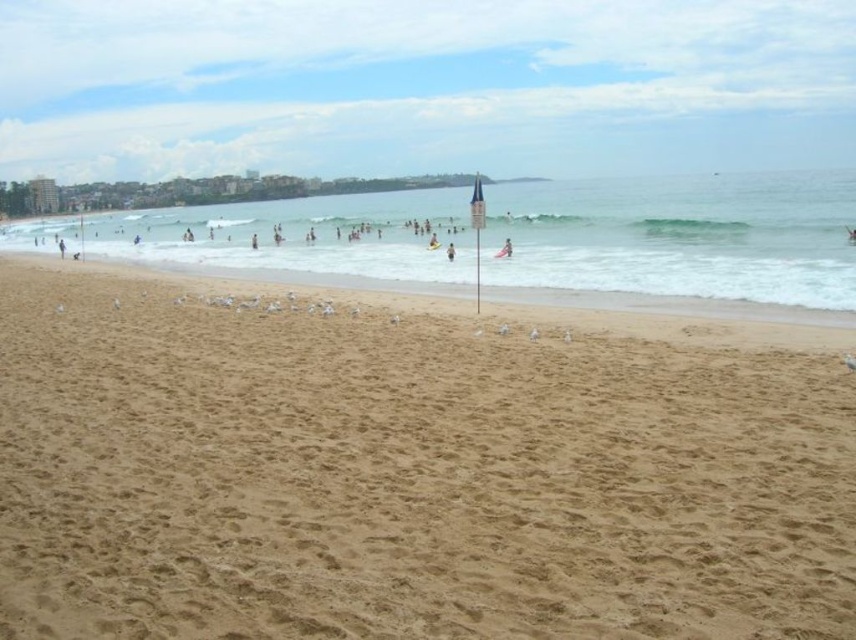
Question: Does clear blue water at center have a larger size compared to yellow rubber ring at center?

Choices:
 (A) no
 (B) yes

Answer: (B)

Question: Is brown sandy beach at center wider than light blue fabric surfboard at center?

Choices:
 (A) yes
 (B) no

Answer: (A)

Question: Can you confirm if light blue fabric surfboard at center is positioned below yellow rubber ring at center?

Choices:
 (A) yes
 (B) no

Answer: (A)

Question: Which object appears closest to the camera in this image?

Choices:
 (A) brown sandy beach at center
 (B) clear blue water at center

Answer: (A)

Question: Which object is closer to the camera taking this photo?

Choices:
 (A) light blue fabric surfboard at center
 (B) clear blue water at center
 (C) brown sandy beach at center
 (D) yellow rubber ring at center

Answer: (C)

Question: Estimate the real-world distances between objects in this image. Which object is closer to the clear blue water at center?

Choices:
 (A) yellow rubber ring at center
 (B) brown sandy beach at center
 (C) light blue fabric surfboard at center

Answer: (B)